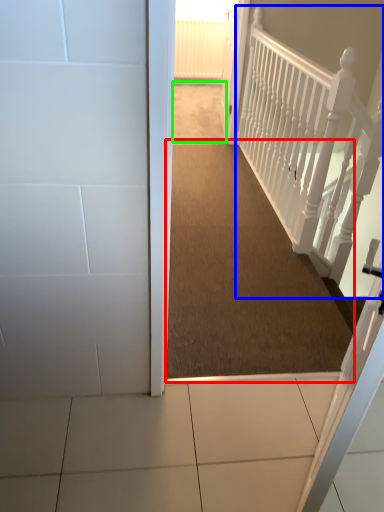
Question: Estimate the real-world distances between objects in this image. Which object is farther from corridor (highlighted by a red box), rail (highlighted by a blue box) or path (highlighted by a green box)?

Choices:
 (A) rail
 (B) path

Answer: (B)